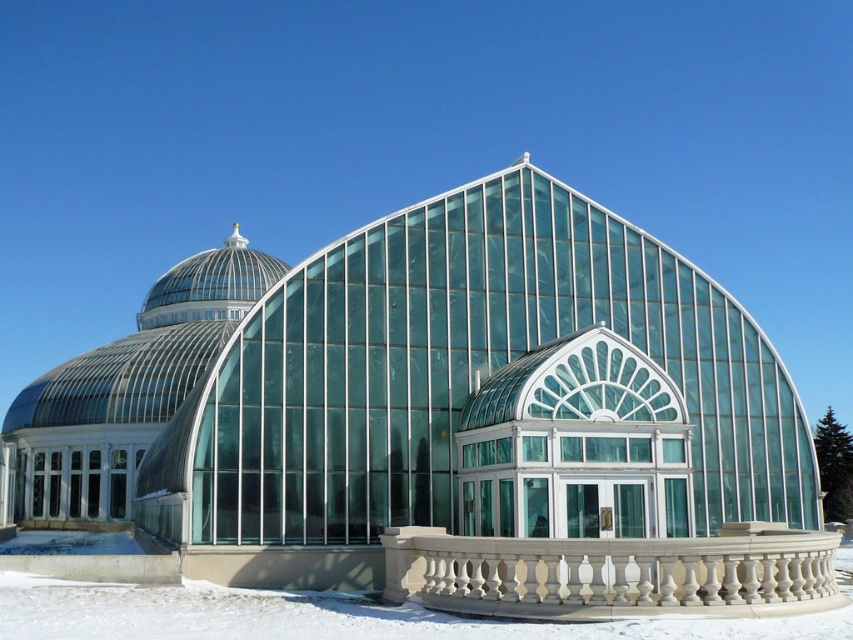
Question: Which of the following is the farthest from the observer?

Choices:
 (A) white powdery snow at lower center
 (B) white stone balustrade at center

Answer: (B)

Question: Is white stone balustrade at center to the right of white powdery snow at lower center from the viewer's perspective?

Choices:
 (A) yes
 (B) no

Answer: (A)

Question: Which of the following is the closest to the observer?

Choices:
 (A) (660, 614)
 (B) (566, 612)

Answer: (A)

Question: Among these objects, which one is nearest to the camera?

Choices:
 (A) white powdery snow at lower center
 (B) white stone balustrade at center

Answer: (A)

Question: Considering the relative positions of white stone balustrade at center and white powdery snow at lower center in the image provided, where is white stone balustrade at center located with respect to white powdery snow at lower center?

Choices:
 (A) right
 (B) left

Answer: (A)

Question: Does white stone balustrade at center appear under white powdery snow at lower center?

Choices:
 (A) yes
 (B) no

Answer: (B)